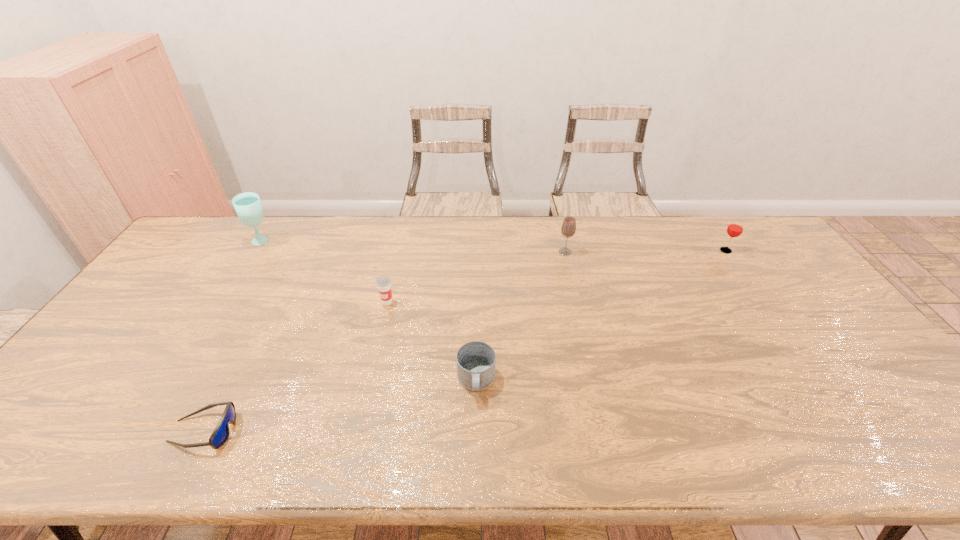
This screenshot has height=540, width=960. In order to click on vacant region that satisfies the following two spatial constraints: 1. on the side of the second shortest object with the handle; 2. on the front-facing side of the shortest object in this screenshot , I will do `click(476, 431)`.